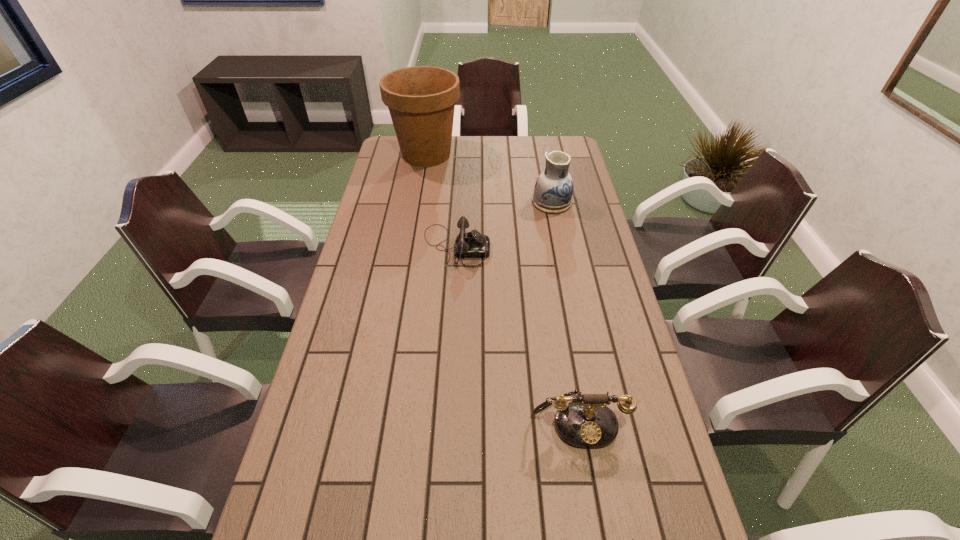
This screenshot has width=960, height=540. What are the coordinates of `blank area located 0.080m on the dial of the nearer telephone` in the screenshot? It's located at (589, 486).

This screenshot has width=960, height=540. I want to click on vacant space located 0.180m on the front-facing side of the shorter telephone, so click(543, 247).

This screenshot has width=960, height=540. In order to click on object positioned at the far edge in this screenshot , I will do [421, 100].

At what (x,y) coordinates should I click in order to perform the action: click on object present at the left edge. Please return your answer as a coordinate pair (x, y). Looking at the image, I should click on (421, 100).

At what (x,y) coordinates should I click in order to perform the action: click on pottery that is at the right edge. Please return your answer as a coordinate pair (x, y). The width and height of the screenshot is (960, 540). Looking at the image, I should click on (553, 191).

Locate an element on the screen. This screenshot has height=540, width=960. telephone that is at the right edge is located at coordinates [586, 422].

You are a GUI agent. You are given a task and a screenshot of the screen. Output one action in this format:
    pyautogui.click(x=<x>, y=<y>)
    Task: Click on the object located at the far left corner
    The image size is (960, 540).
    Given the screenshot: What is the action you would take?
    pyautogui.click(x=421, y=100)

Where is `vacant space at the far edge`? vacant space at the far edge is located at coordinates (500, 158).

In the image, there is a desktop. At what (x,y) coordinates should I click in order to perform the action: click on vacant space at the left edge. Please return your answer as a coordinate pair (x, y). Image resolution: width=960 pixels, height=540 pixels. Looking at the image, I should click on (368, 288).

You are a GUI agent. You are given a task and a screenshot of the screen. Output one action in this format:
    pyautogui.click(x=<x>, y=<y>)
    Task: Click on the vacant space at the right edge of the desktop
    
    Given the screenshot: What is the action you would take?
    pyautogui.click(x=579, y=225)